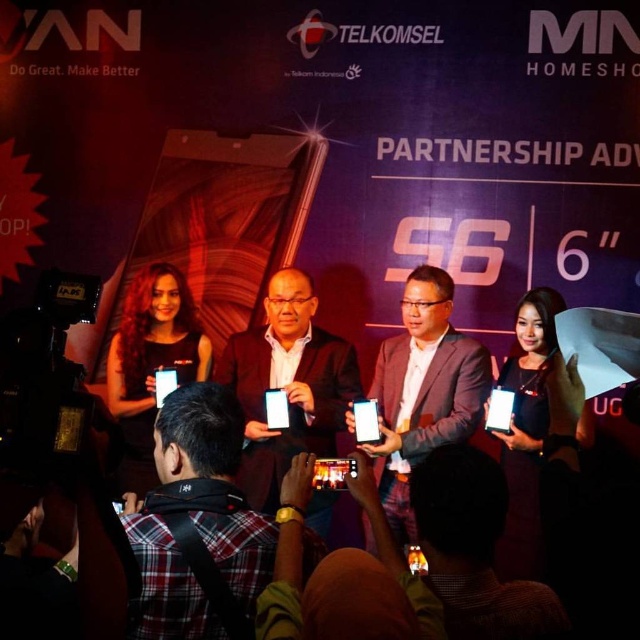
Can you confirm if plaid shirt at lower left is positioned to the left of matte black phone at center?

Indeed, plaid shirt at lower left is positioned on the left side of matte black phone at center.

Does plaid shirt at lower left have a lesser width compared to matte black phone at center?

Yes.

Between point (179, 554) and point (326, 512), which one is positioned in front?

Point (179, 554) is in front.

Locate an element on the screen. The image size is (640, 640). plaid shirt at lower left is located at coordinates (198, 525).

Who is lower down, plaid shirt at lower left or matte black suit at center?

matte black suit at center is below.

Is point (204, 573) positioned behind point (384, 380)?

No, it is not.

Between point (179, 624) and point (417, 305), which one is positioned in front?

Positioned in front is point (179, 624).

Identify the location of plaid shirt at lower left. (198, 525).

Is matte black phone at center wider than matte black suit at center?

Yes, matte black phone at center is wider than matte black suit at center.

Which is in front, point (244, 355) or point (406, 412)?

Positioned in front is point (406, 412).

At what (x,y) coordinates should I click in order to perform the action: click on matte black phone at center. Please return your answer as a coordinate pair (x, y). The image size is (640, 640). Looking at the image, I should click on (285, 385).